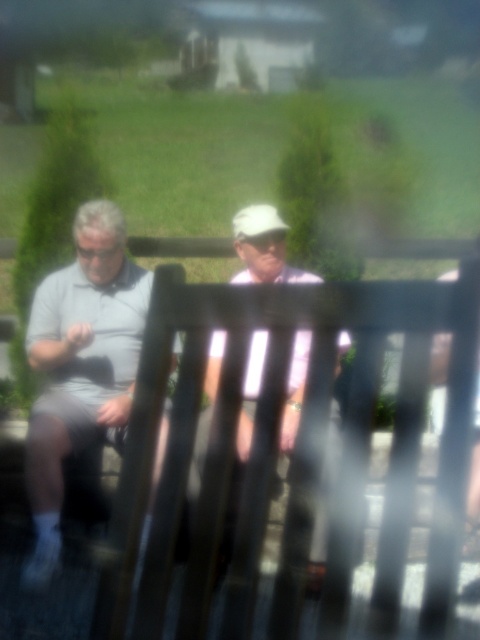
You are a delivery person who needs to place a 50 cm wide package between the gray matte shirt at left and the white matte shirt at center. Can the package fit in the space between them?

The distance between the gray matte shirt at left and the white matte shirt at center is 51.44 centimeters, so the 50 cm wide package can fit in the space between them.